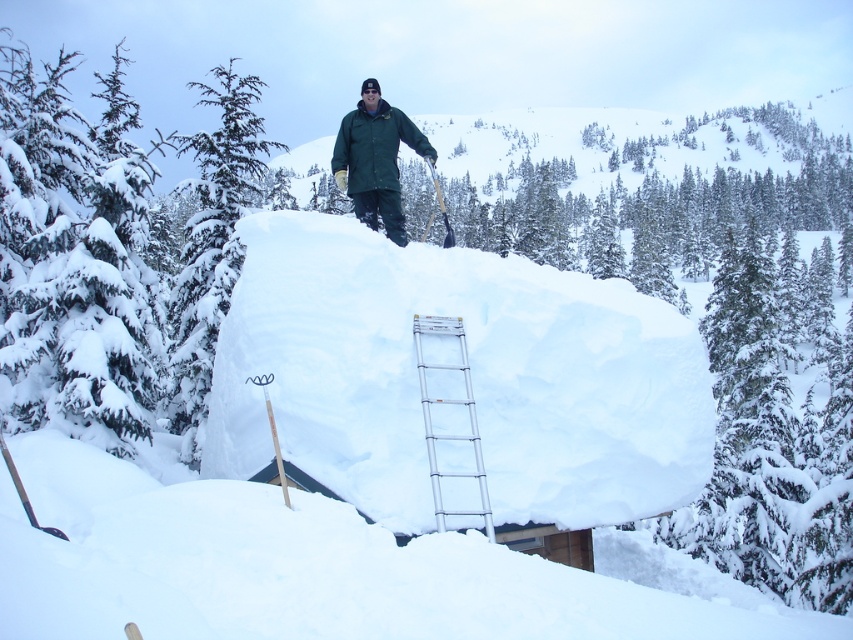
You are standing in the snowy scene and want to build a snowman. The white fluffy snow at center is the only snow available. Can you use it to build the snowman?

Yes, the white fluffy snow at center is the only snow available, so you can use it to build the snowman.

You are standing at the base of the snow mound and want to retrieve your shovel from the person on top. The silver metallic ladder at center is between you and the snowy evergreen tree at left. Which object should you move around to reach the person?

You should move around the silver metallic ladder at center because the snowy evergreen tree at left is to the left of it, so going around the ladder would allow you to access the path towards the top of the snow mound.

You are planning to take a photo of the snowy evergreen tree at left and the silver metallic ladder at center. Which object should you focus on first if you want to capture both in the same frame without moving the camera?

The snowy evergreen tree at left is much taller than the silver metallic ladder at center, so you should focus on the tree first to ensure its full height fits in the frame while still capturing the ladder.